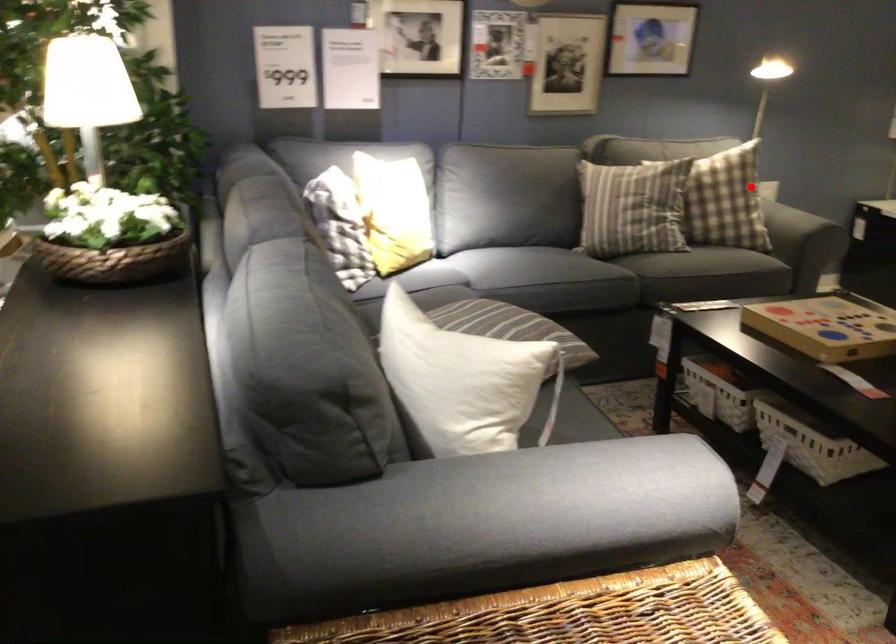
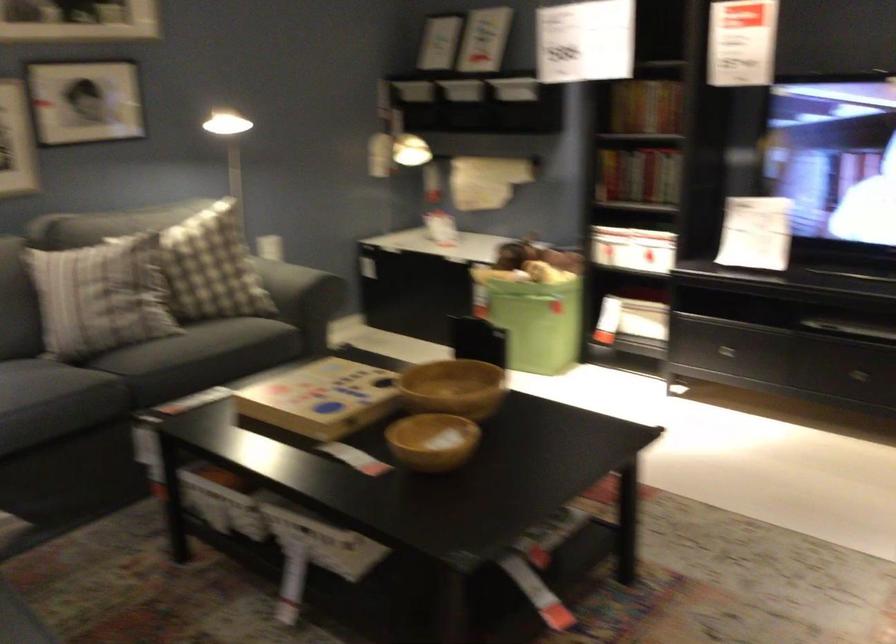
Locate, in the second image, the point that corresponds to the highlighted location in the first image.

(211, 267)